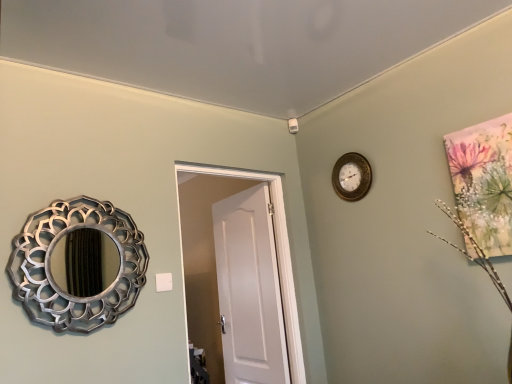
Question: From a real-world perspective, is gold metallic wall clock at upper center over silver metallic mirror at left?

Choices:
 (A) yes
 (B) no

Answer: (A)

Question: From the image's perspective, is gold metallic wall clock at upper center under silver metallic mirror at left?

Choices:
 (A) yes
 (B) no

Answer: (B)

Question: Does gold metallic wall clock at upper center appear on the right side of silver metallic mirror at left?

Choices:
 (A) no
 (B) yes

Answer: (B)

Question: Would you consider gold metallic wall clock at upper center to be distant from silver metallic mirror at left?

Choices:
 (A) no
 (B) yes

Answer: (B)

Question: Considering the relative sizes of gold metallic wall clock at upper center and silver metallic mirror at left in the image provided, is gold metallic wall clock at upper center bigger than silver metallic mirror at left?

Choices:
 (A) no
 (B) yes

Answer: (A)

Question: Can you confirm if gold metallic wall clock at upper center is wider than silver metallic mirror at left?

Choices:
 (A) no
 (B) yes

Answer: (A)

Question: Considering the relative sizes of white matte door at center and gold metallic wall clock at upper center in the image provided, is white matte door at center bigger than gold metallic wall clock at upper center?

Choices:
 (A) no
 (B) yes

Answer: (B)

Question: Is gold metallic wall clock at upper center completely or partially inside white matte door at center?

Choices:
 (A) no
 (B) yes

Answer: (A)

Question: From a real-world perspective, is white matte door at center positioned under gold metallic wall clock at upper center based on gravity?

Choices:
 (A) no
 (B) yes

Answer: (B)

Question: Could you tell me if white matte door at center is facing gold metallic wall clock at upper center?

Choices:
 (A) no
 (B) yes

Answer: (A)

Question: Is white matte door at center at the right side of gold metallic wall clock at upper center?

Choices:
 (A) no
 (B) yes

Answer: (A)

Question: Is white matte door at center not near gold metallic wall clock at upper center?

Choices:
 (A) yes
 (B) no

Answer: (B)

Question: Is silver metallic mirror at left thinner than gold metallic wall clock at upper center?

Choices:
 (A) no
 (B) yes

Answer: (A)